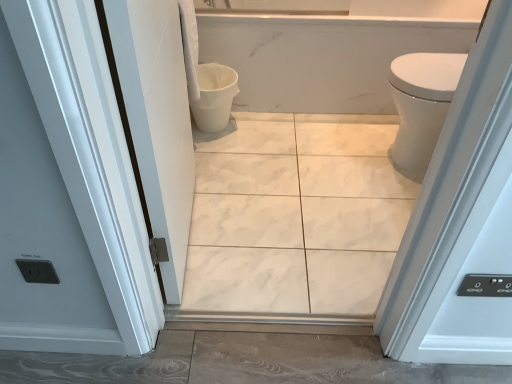
At what (x,y) coordinates should I click in order to perform the action: click on vacant space to the right of white glossy door at left. Please return your answer as a coordinate pair (x, y). Looking at the image, I should click on (270, 229).